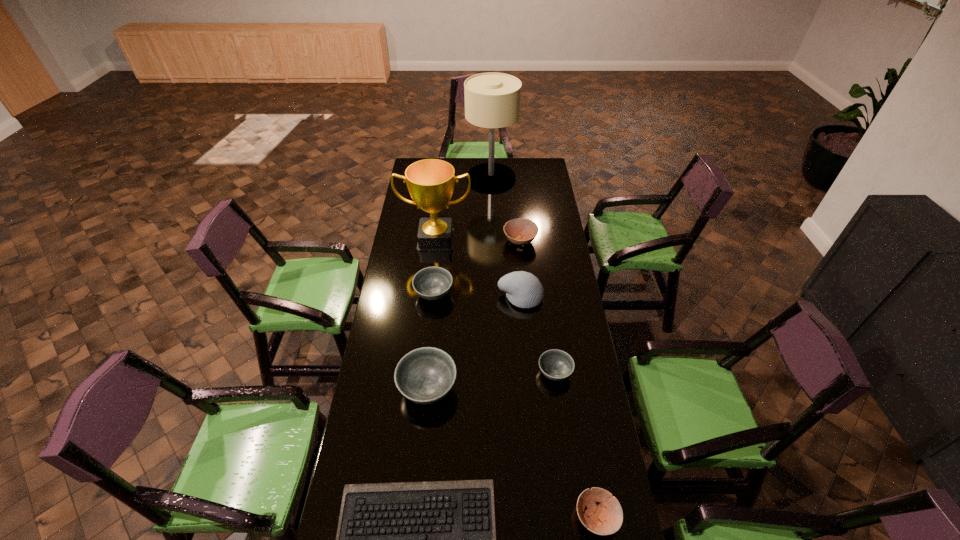
Locate an element on the screen. the farthest bowl is located at coordinates (521, 231).

The width and height of the screenshot is (960, 540). Identify the location of the smallest gray bowl. (557, 365).

This screenshot has height=540, width=960. I want to click on blank space located 0.300m on the front of the farthest object, so click(492, 224).

At what (x,y) coordinates should I click in order to perform the action: click on free space located on the front-facing side of the second tallest object. Please return your answer as a coordinate pair (x, y). Looking at the image, I should click on (429, 302).

The height and width of the screenshot is (540, 960). I want to click on vacant space located 0.320m on the back of the gray beanie, so click(x=516, y=239).

Where is `vacant space located on the back of the sixth shortest object`? Image resolution: width=960 pixels, height=540 pixels. vacant space located on the back of the sixth shortest object is located at coordinates (435, 318).

The image size is (960, 540). In order to click on vacant space located 0.260m on the back of the second biggest gray bowl in this screenshot , I will do `click(439, 243)`.

Identify the location of free space located on the left of the bigger brown bowl. (454, 241).

The height and width of the screenshot is (540, 960). Identify the location of vacant space located on the left of the rightmost gray bowl. (446, 373).

The height and width of the screenshot is (540, 960). Identify the location of object present at the far edge. (492, 100).